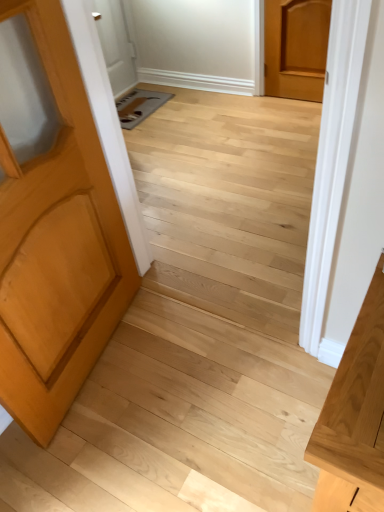
The height and width of the screenshot is (512, 384). I want to click on vacant space situated on the left part of light brown wood door at upper right, arranged as the first door when viewed from the right, so click(x=271, y=103).